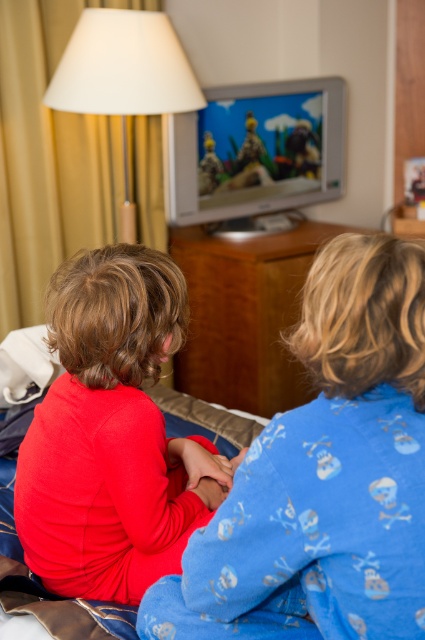
You are organizing a playroom and need to place a new toy between the red fleece shirt at center and the brown wood dresser at center. Based on their positions, which object should the toy be closer to?

The red fleece shirt at center is positioned on the left side of the brown wood dresser at center, so the toy should be placed closer to the red fleece shirt at center to maintain symmetry between them.

You are organizing a small toy that is 15 cm wide. You see the matte red shirt at center and the brown wood dresser at center. Which object can the toy fit on without overhanging?

The matte red shirt at center has a lesser width compared to brown wood dresser at center, so the toy can fit on the brown wood dresser at center since it is wider than the toy.

You are a delivery person who needs to place a small package on the bed where the two children are sitting. The package must be placed at the exact coordinates of point [323,476]. However, you notice an object already present at that location. What object is blocking the placement of the package?

The red fleece shirt at center is blocking the placement of the package at point [323,476].